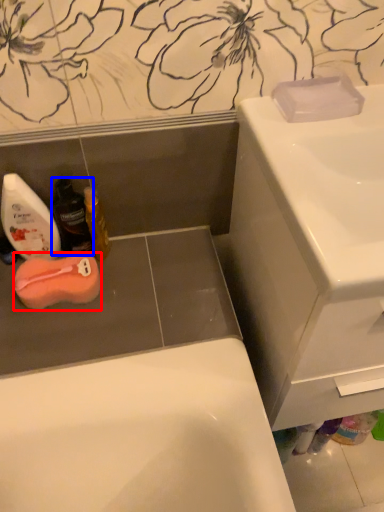
Question: Which point is closer to the camera, soap (highlighted by a red box) or mouthwash (highlighted by a blue box)?

Choices:
 (A) soap
 (B) mouthwash

Answer: (B)